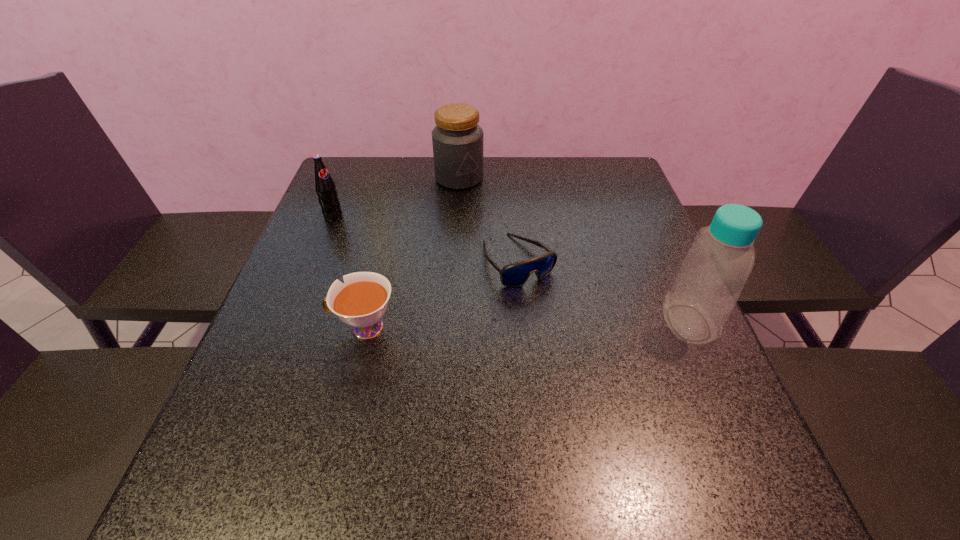
At what (x,y) coordinates should I click in order to perform the action: click on vacant area situated on the front-facing side of the sunglasses. Please return your answer as a coordinate pair (x, y). Looking at the image, I should click on (645, 428).

Find the location of a particular element. The height and width of the screenshot is (540, 960). vacant region located on the front-facing side of the sunglasses is located at coordinates (553, 308).

In order to click on object that is at the far edge in this screenshot , I will do `click(457, 139)`.

Where is `teacup located at the left edge`? The height and width of the screenshot is (540, 960). teacup located at the left edge is located at coordinates (361, 302).

Identify the location of pop that is at the left edge. (325, 187).

This screenshot has height=540, width=960. I want to click on object present at the right edge, so pos(712,275).

Where is `free region at the far edge`? free region at the far edge is located at coordinates (457, 199).

At what (x,y) coordinates should I click in order to perform the action: click on vacant space at the near edge of the desktop. Please return your answer as a coordinate pair (x, y). The height and width of the screenshot is (540, 960). Looking at the image, I should click on (639, 442).

Find the location of a particular element. The height and width of the screenshot is (540, 960). vacant area at the right edge of the desktop is located at coordinates (664, 345).

In order to click on vacant space at the far left corner of the desktop in this screenshot , I will do `click(372, 171)`.